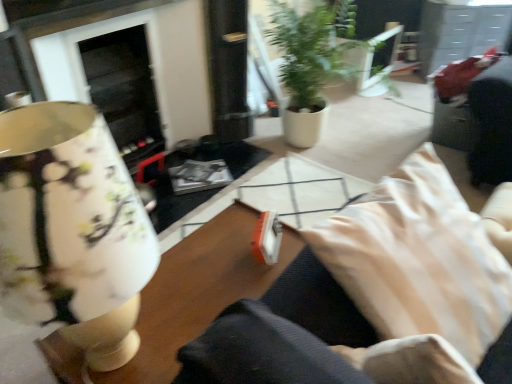
Image resolution: width=512 pixels, height=384 pixels. Find the location of `free space to the back side of matte floral lampshade at left`. free space to the back side of matte floral lampshade at left is located at coordinates (188, 271).